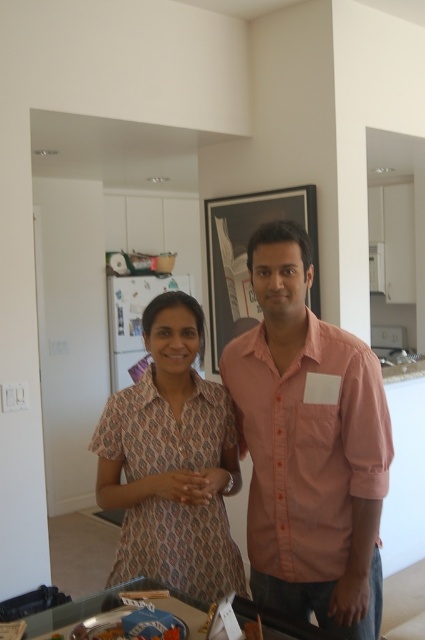
You are organizing a charity event and need to decide which clothing item to display first. The pink cotton shirt at center and the dull pink printed blouse at center are both available. Based on their sizes, which one should you choose to place in the main display area to attract more attention?

The pink cotton shirt at center has a larger size compared to the dull pink printed blouse at center, so it should be placed in the main display area to attract more attention due to its bigger size.

You are standing in a modern kitchen and want to reach the point at coordinates (379, 470). If you take one step forward, will you be closer to the point?

The point at coordinates (379, 470) is 1.51 meters away from the viewer. Taking one step forward would reduce the distance, so yes, you would be closer to the point.